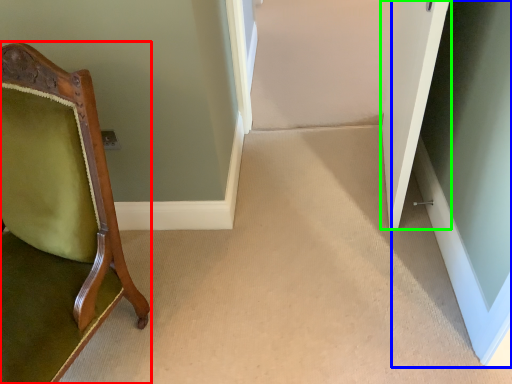
Question: Considering the real-world distances, which object is farthest from chair (highlighted by a red box)? glass door (highlighted by a blue box) or door (highlighted by a green box)?

Choices:
 (A) glass door
 (B) door

Answer: (A)